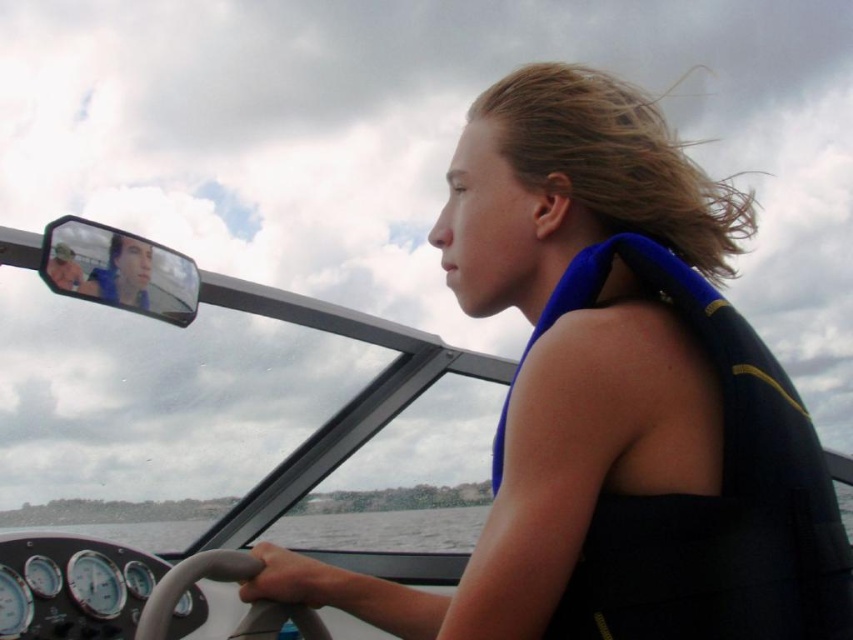
You are a safety inspector on a boat and need to ensure all life preservers are properly positioned. According to the image, which life preserver is positioned higher, the blue neoprene life vest at center or the blue fabric life jacket at center?

The blue neoprene life vest at center is located above the blue fabric life jacket at center, so it is positioned higher.